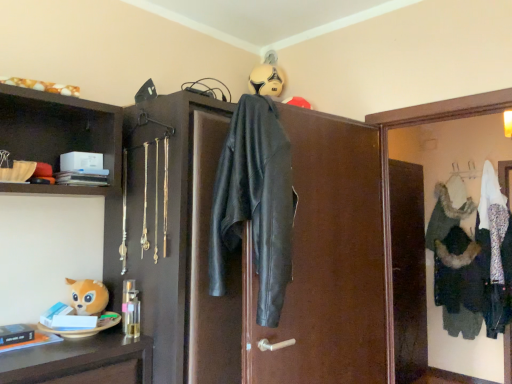
Question: From the image's perspective, is white fabric medicine cabinet at upper right located above or below white fur coat at center?

Choices:
 (A) below
 (B) above

Answer: (B)

Question: Would you say white fabric medicine cabinet at upper right is to the left or to the right of white fur coat at center in the picture?

Choices:
 (A) right
 (B) left

Answer: (B)

Question: Considering the real-world distances, which object is closest to the white fur coat at center?

Choices:
 (A) black leather jacket at center
 (B) white fabric medicine cabinet at upper right
 (C) black leather jacket at center

Answer: (B)

Question: Considering the real-world distances, which object is farthest from the white fur coat at center?

Choices:
 (A) black leather jacket at center
 (B) black leather jacket at center
 (C) white fabric medicine cabinet at upper right

Answer: (A)